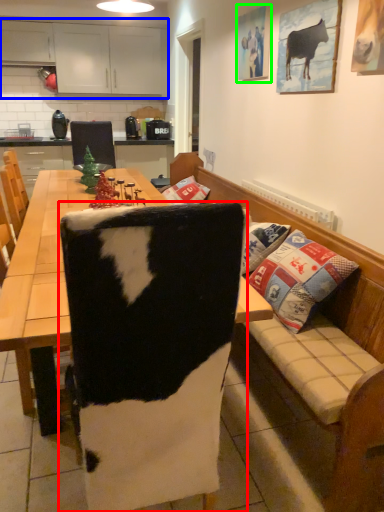
Question: Estimate the real-world distances between objects in this image. Which object is farther from chair (highlighted by a red box), cabinetry (highlighted by a blue box) or picture frame (highlighted by a green box)?

Choices:
 (A) cabinetry
 (B) picture frame

Answer: (A)